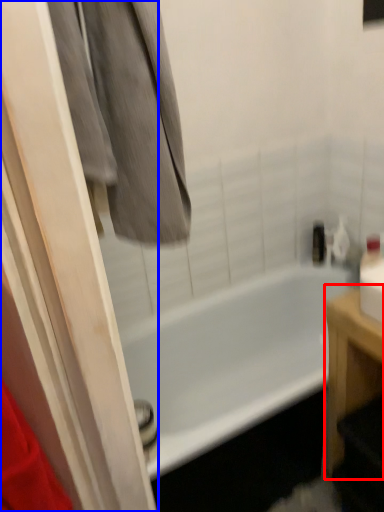
Question: Which point is further to the camera, furniture (highlighted by a red box) or screen door (highlighted by a blue box)?

Choices:
 (A) furniture
 (B) screen door

Answer: (A)